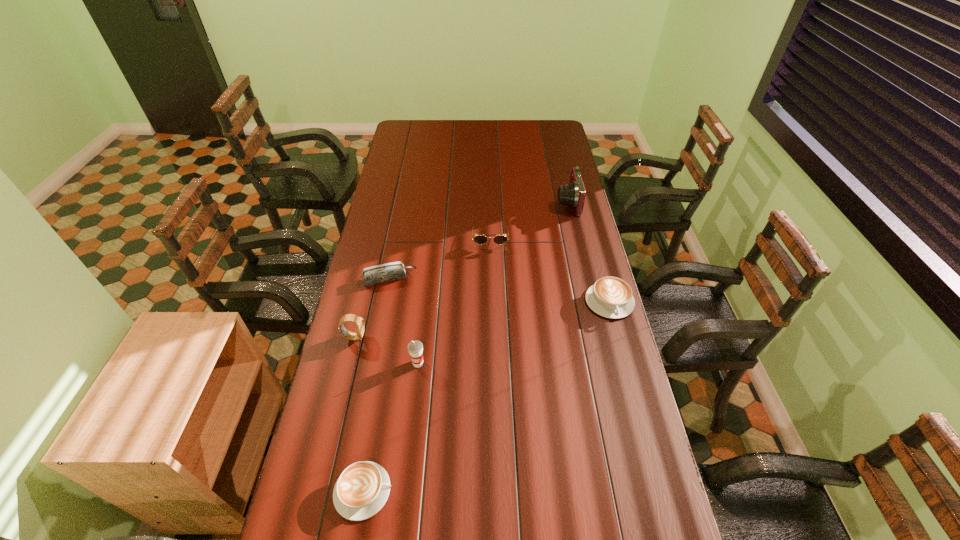
Identify the location of free spot between the farthest object and the shorter cappuccino. (466, 347).

Locate an element on the screen. free spot between the right cappuccino and the watch is located at coordinates (482, 320).

This screenshot has height=540, width=960. I want to click on blank region between the watch and the fourth object from left to right, so click(x=386, y=350).

Locate an element on the screen. This screenshot has width=960, height=540. the third closest object to the farthest object is located at coordinates (387, 272).

Select which object appears as the sixth closest to the third object from right to left. Please provide its 2D coordinates. Your answer should be formatted as a tuple, i.e. [(x, y)], where the tuple contains the x and y coordinates of a point satisfying the conditions above.

[(362, 489)]

The height and width of the screenshot is (540, 960). Find the location of `vacant area that satisfies the following two spatial constraints: 1. on the side of the cup with the logo; 2. on the side of the nearest object with the handle`. vacant area that satisfies the following two spatial constraints: 1. on the side of the cup with the logo; 2. on the side of the nearest object with the handle is located at coordinates (403, 491).

In order to click on free space that satisfies the following two spatial constraints: 1. on the front lenses of the sunglasses; 2. on the face of the watch in this screenshot , I will do `click(492, 337)`.

At what (x,y) coordinates should I click in order to perform the action: click on vacant space that satisfies the following two spatial constraints: 1. on the side of the second nearest object with the logo; 2. on the side of the shorter cappuccino with the handle. Please return your answer as a coordinate pair (x, y). This screenshot has height=540, width=960. Looking at the image, I should click on (403, 491).